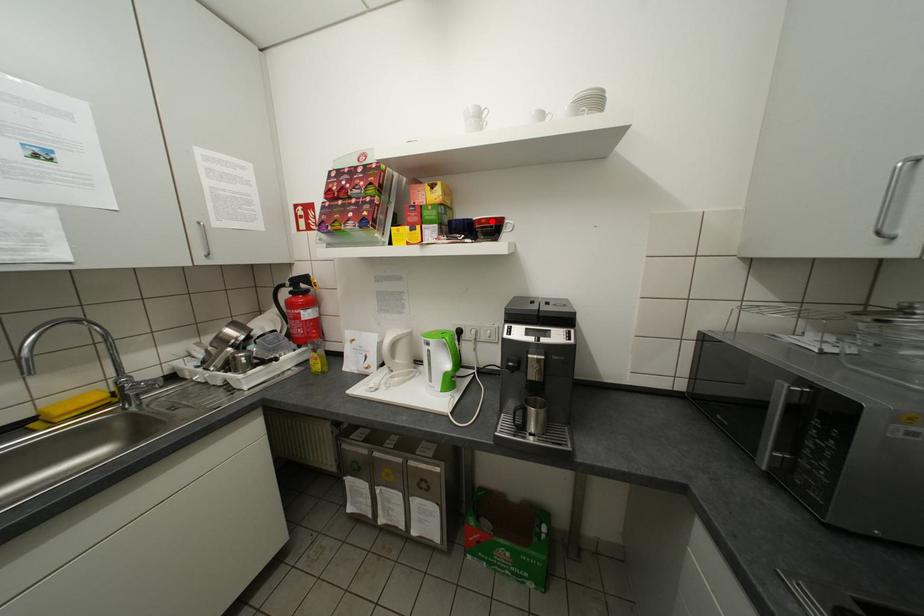
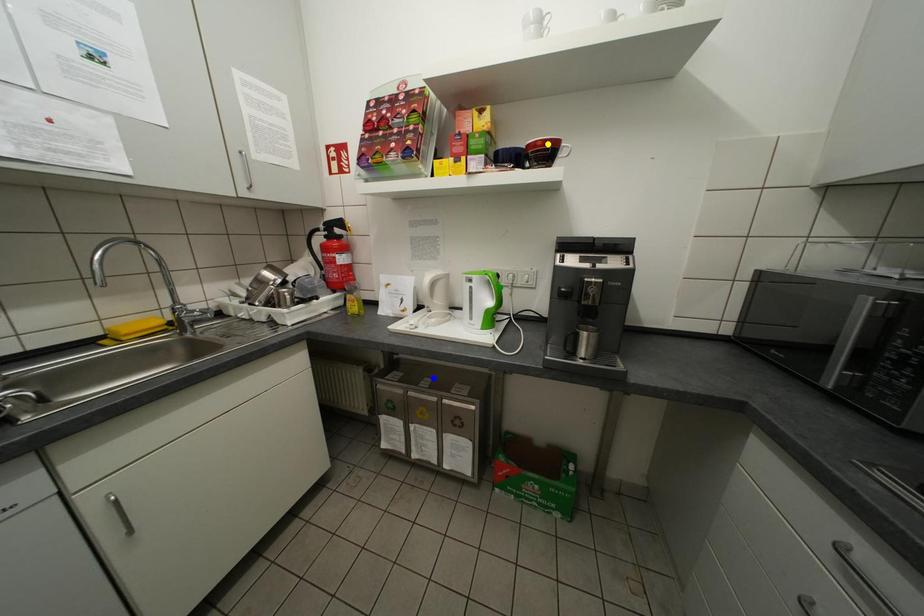
Question: I am providing you with two images of the same scene from different viewpoints. A red point is marked on the first image. You are given multiple points on the second image. Which point in image 2 represents the same 3d spot as the red point in image 1?

Choices:
 (A) green point
 (B) yellow point
 (C) blue point

Answer: (B)